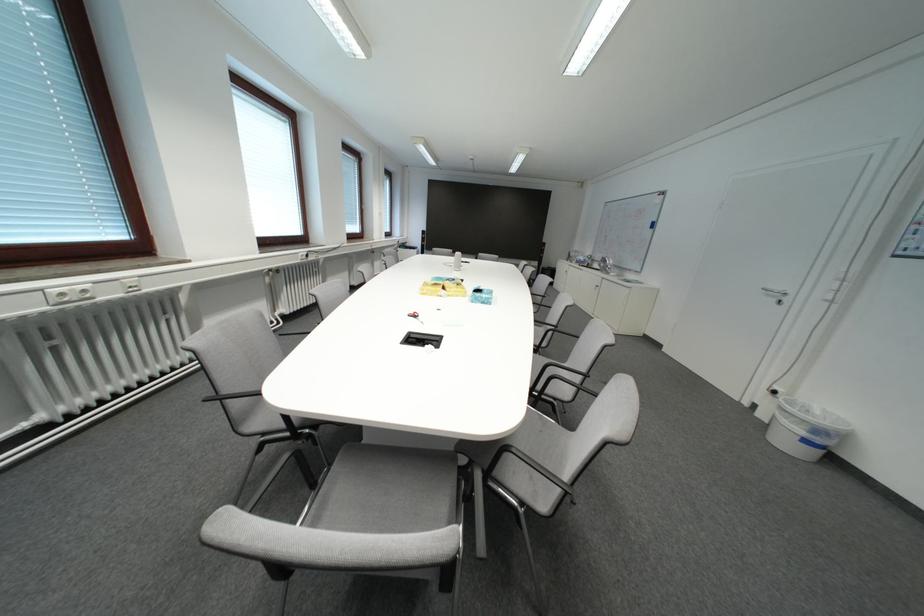
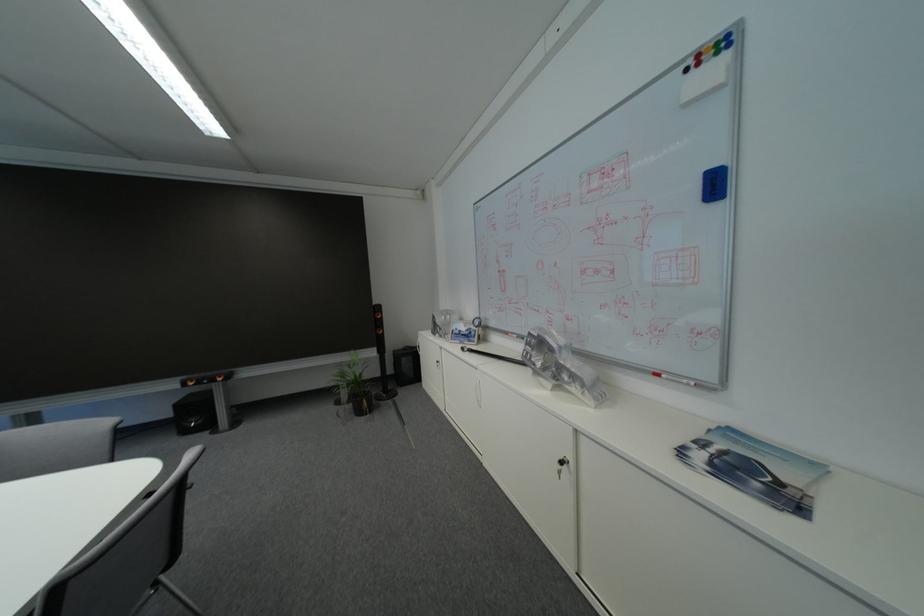
In the second image, find the point that corresponds to point 545,267 in the first image.

(382, 355)